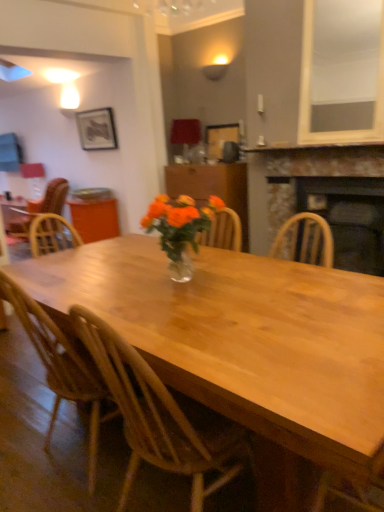
Question: From the image's perspective, is rustic stone fireplace at right, which ranks as the 1th fireplace in top-to-bottom order, on stone fireplace at upper center?

Choices:
 (A) no
 (B) yes

Answer: (A)

Question: Is rustic stone fireplace at right, which ranks as the 1th fireplace in top-to-bottom order, next to stone fireplace at upper center and touching it?

Choices:
 (A) yes
 (B) no

Answer: (B)

Question: Is rustic stone fireplace at right, which ranks as the 1th fireplace in top-to-bottom order, not within stone fireplace at upper center?

Choices:
 (A) no
 (B) yes

Answer: (B)

Question: Is rustic stone fireplace at right, which ranks as the 1th fireplace in top-to-bottom order, wider than stone fireplace at upper center?

Choices:
 (A) no
 (B) yes

Answer: (B)

Question: Considering the relative sizes of rustic stone fireplace at right, marked as the second fireplace in a bottom-to-top arrangement, and stone fireplace at upper center in the image provided, is rustic stone fireplace at right, marked as the second fireplace in a bottom-to-top arrangement, thinner than stone fireplace at upper center?

Choices:
 (A) no
 (B) yes

Answer: (A)

Question: Can you confirm if rustic stone fireplace at right, marked as the second fireplace in a bottom-to-top arrangement, is bigger than stone fireplace at upper center?

Choices:
 (A) yes
 (B) no

Answer: (A)

Question: Can you confirm if wooden cabinet at center is positioned to the right of rustic stone fireplace at right, which ranks as the 1th fireplace in top-to-bottom order?

Choices:
 (A) no
 (B) yes

Answer: (A)

Question: From the image's perspective, is wooden cabinet at center located above rustic stone fireplace at right, which ranks as the 1th fireplace in top-to-bottom order?

Choices:
 (A) yes
 (B) no

Answer: (A)

Question: Is wooden cabinet at center bigger than rustic stone fireplace at right, marked as the second fireplace in a bottom-to-top arrangement?

Choices:
 (A) yes
 (B) no

Answer: (A)

Question: Is wooden cabinet at center not close to rustic stone fireplace at right, which ranks as the 1th fireplace in top-to-bottom order?

Choices:
 (A) no
 (B) yes

Answer: (A)

Question: Does wooden cabinet at center come in front of rustic stone fireplace at right, marked as the second fireplace in a bottom-to-top arrangement?

Choices:
 (A) yes
 (B) no

Answer: (B)

Question: Does wooden cabinet at center have a greater width compared to rustic stone fireplace at right, which ranks as the 1th fireplace in top-to-bottom order?

Choices:
 (A) no
 (B) yes

Answer: (B)

Question: Is wooden at left, which is the 2th chair in right-to-left order, located within black stone fireplace at center, which ranks as the second fireplace in top-to-bottom order?

Choices:
 (A) yes
 (B) no

Answer: (B)